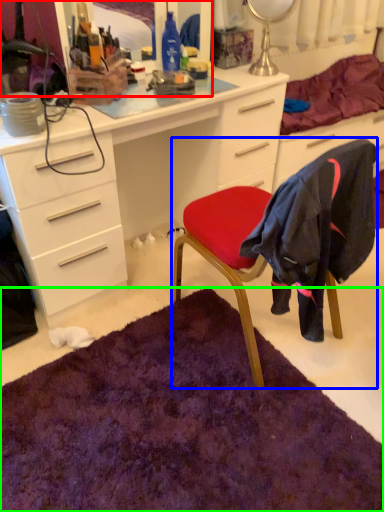
Question: Considering the real-world distances, which object is farthest from mirror (highlighted by a red box)? chair (highlighted by a blue box) or mat (highlighted by a green box)?

Choices:
 (A) chair
 (B) mat

Answer: (B)